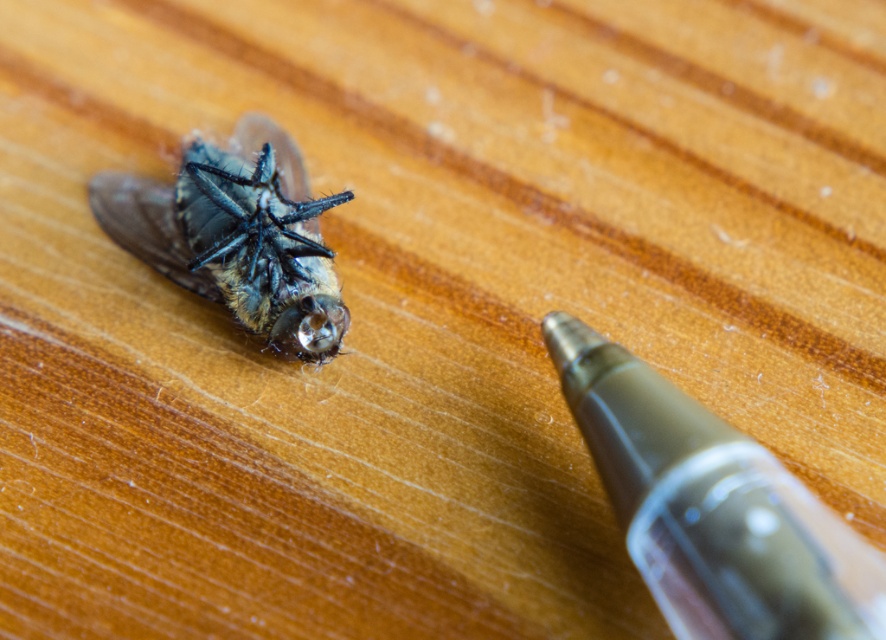
Question: Which point is farther to the camera?

Choices:
 (A) (201, 188)
 (B) (778, 504)

Answer: (A)

Question: From the image, what is the correct spatial relationship of transparent plastic pen at lower right in relation to shiny black insect at upper left?

Choices:
 (A) below
 (B) above

Answer: (A)

Question: Is transparent plastic pen at lower right to the left of shiny black insect at upper left from the viewer's perspective?

Choices:
 (A) yes
 (B) no

Answer: (B)

Question: Is transparent plastic pen at lower right thinner than shiny black insect at upper left?

Choices:
 (A) yes
 (B) no

Answer: (A)

Question: Which point is closer to the camera?

Choices:
 (A) (708, 422)
 (B) (340, 193)

Answer: (A)